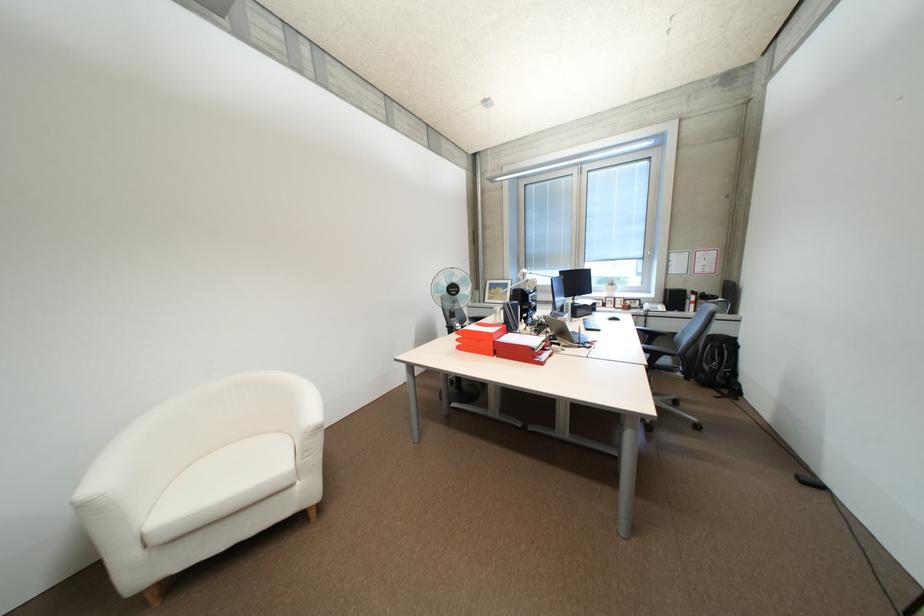
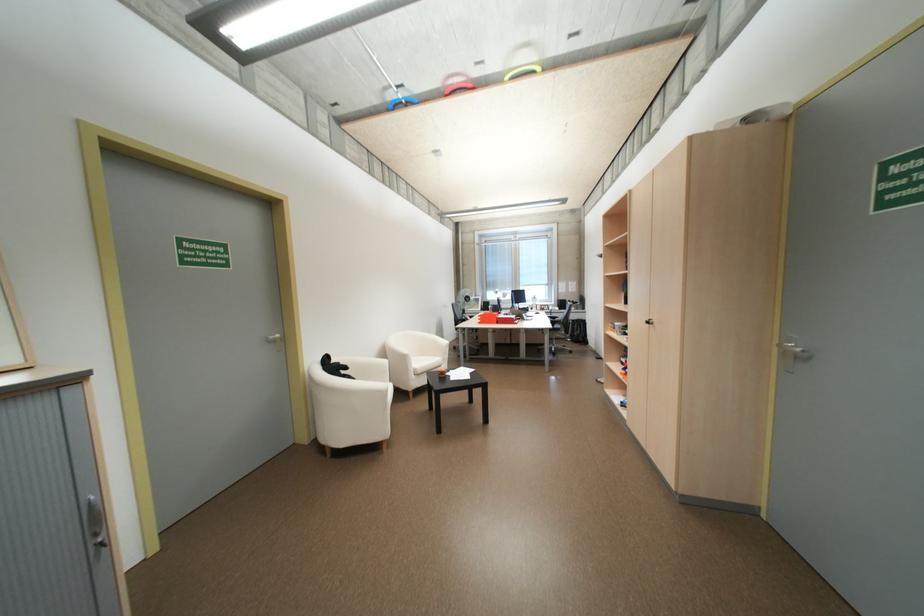
The images are taken continuously from a first-person perspective. In which direction are you moving?

The cameraman walked toward left, backward.